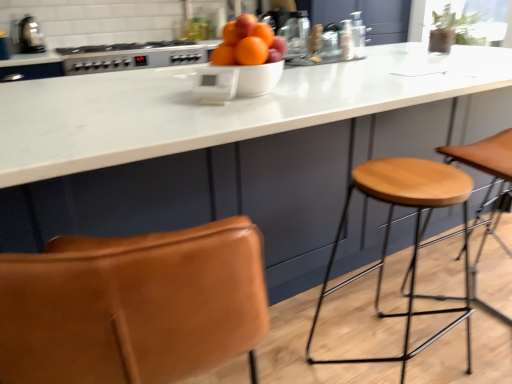
Locate an element on the screen. The image size is (512, 384). free point in front of white glossy bowl at center is located at coordinates (238, 102).